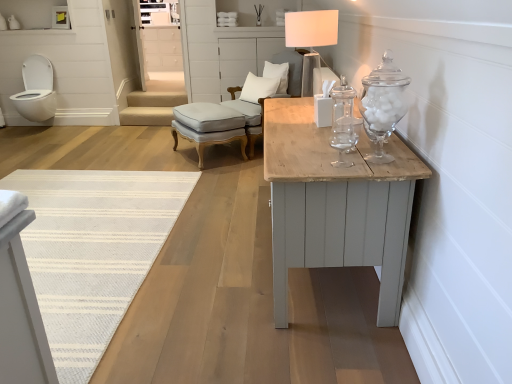
Question: Should I look upward or downward to see light gray fabric armchair at center?

Choices:
 (A) down
 (B) up

Answer: (B)

Question: Is white soft pillow at upper center, the 1th pillow viewed from the top, shorter than light gray fabric armchair at center?

Choices:
 (A) yes
 (B) no

Answer: (A)

Question: Is white soft pillow at upper center, the 1th pillow viewed from the top, positioned with its back to light gray fabric armchair at center?

Choices:
 (A) no
 (B) yes

Answer: (B)

Question: From a real-world perspective, is white soft pillow at upper center, marked as the second pillow in a bottom-to-top arrangement, positioned under light gray fabric armchair at center based on gravity?

Choices:
 (A) no
 (B) yes

Answer: (A)

Question: Considering the relative sizes of white soft pillow at upper center, marked as the second pillow in a bottom-to-top arrangement, and light gray fabric armchair at center in the image provided, is white soft pillow at upper center, marked as the second pillow in a bottom-to-top arrangement, taller than light gray fabric armchair at center?

Choices:
 (A) no
 (B) yes

Answer: (A)

Question: From a real-world perspective, is white soft pillow at upper center, marked as the second pillow in a bottom-to-top arrangement, over light gray fabric armchair at center?

Choices:
 (A) yes
 (B) no

Answer: (A)

Question: Is the position of white soft pillow at upper center, the 1th pillow viewed from the top, more distant than that of light gray fabric armchair at center?

Choices:
 (A) no
 (B) yes

Answer: (B)

Question: Is clear glass jar at center smaller than white fabric lampshade at upper center?

Choices:
 (A) yes
 (B) no

Answer: (A)

Question: Can you confirm if clear glass jar at center is bigger than white fabric lampshade at upper center?

Choices:
 (A) yes
 (B) no

Answer: (B)

Question: Can we say clear glass jar at center lies outside white fabric lampshade at upper center?

Choices:
 (A) yes
 (B) no

Answer: (A)

Question: Could you tell me if clear glass jar at center is facing white fabric lampshade at upper center?

Choices:
 (A) yes
 (B) no

Answer: (B)

Question: Is white fabric lampshade at upper center surrounded by clear glass jar at center?

Choices:
 (A) yes
 (B) no

Answer: (B)

Question: Can you see clear glass jar at center touching white fabric lampshade at upper center?

Choices:
 (A) no
 (B) yes

Answer: (A)

Question: Can you confirm if clear glass jar at center is bigger than white glossy toilet at left?

Choices:
 (A) no
 (B) yes

Answer: (A)